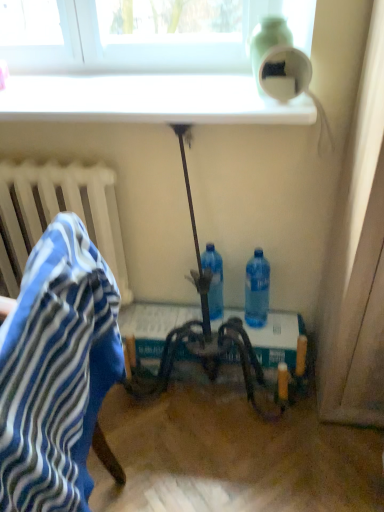
The width and height of the screenshot is (384, 512). Find the location of `free spot below metallic silver table at center (from a real-world perspective)`. free spot below metallic silver table at center (from a real-world perspective) is located at coordinates (221, 398).